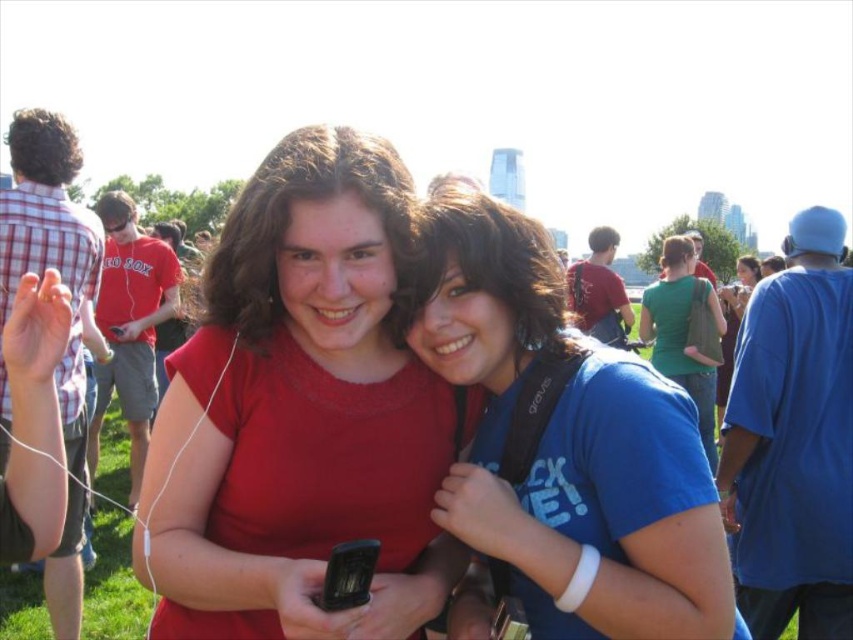
Question: Estimate the real-world distances between objects in this image. Which object is farther from the green matte shirt at center?

Choices:
 (A) matte red shirt at center
 (B) blue matte t-shirt at center

Answer: (A)

Question: Does blue matte t-shirt at center have a lesser width compared to green matte shirt at center?

Choices:
 (A) yes
 (B) no

Answer: (B)

Question: Among these objects, which one is farthest from the camera?

Choices:
 (A) matte red shirt at center
 (B) green matte shirt at center

Answer: (B)

Question: Based on their relative distances, which object is farther from the blue matte t-shirt at center?

Choices:
 (A) matte red shirt at center
 (B) green matte shirt at center

Answer: (A)

Question: Does matte red shirt at center have a smaller size compared to green matte shirt at center?

Choices:
 (A) yes
 (B) no

Answer: (B)

Question: Does matte red shirt at center lie in front of blue matte t-shirt at center?

Choices:
 (A) yes
 (B) no

Answer: (B)